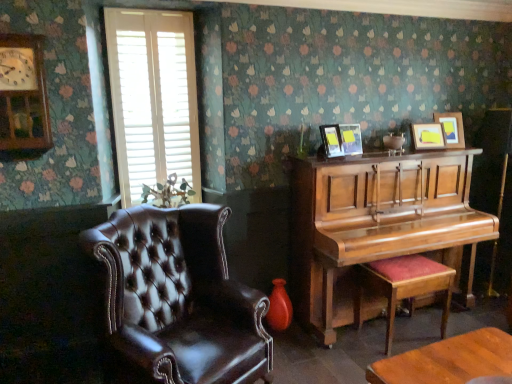
Identify the location of free location to the right of matte black picture frame at upper center, placed as the fourth picture frame when sorted from right to left. This screenshot has height=384, width=512. (353, 164).